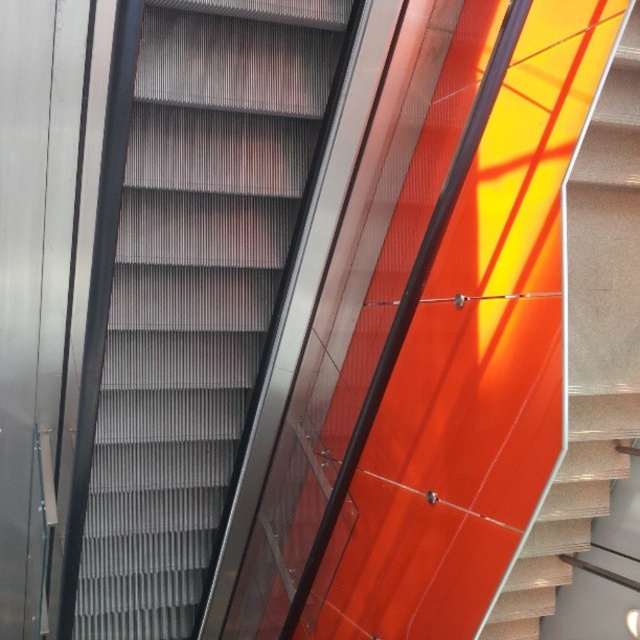
You are a maintenance worker needing to check the distance between the metallic gray escalator steps at center and the matte orange wall at right. According to safety regulations, the minimum distance required is 1.5 meters. Can you confirm if the current spacing meets the requirement?

The metallic gray escalator steps at center and matte orange wall at right are 1.61 meters apart from each other, which exceeds the 1.5 meters minimum requirement, so it meets the safety regulations.

You are standing on the platform next to the metallic gray escalator steps at center and the matte orange wall at right. Which object is located to your left?

The metallic gray escalator steps at center is positioned on the left side of matte orange wall at right, so it is located to your left.